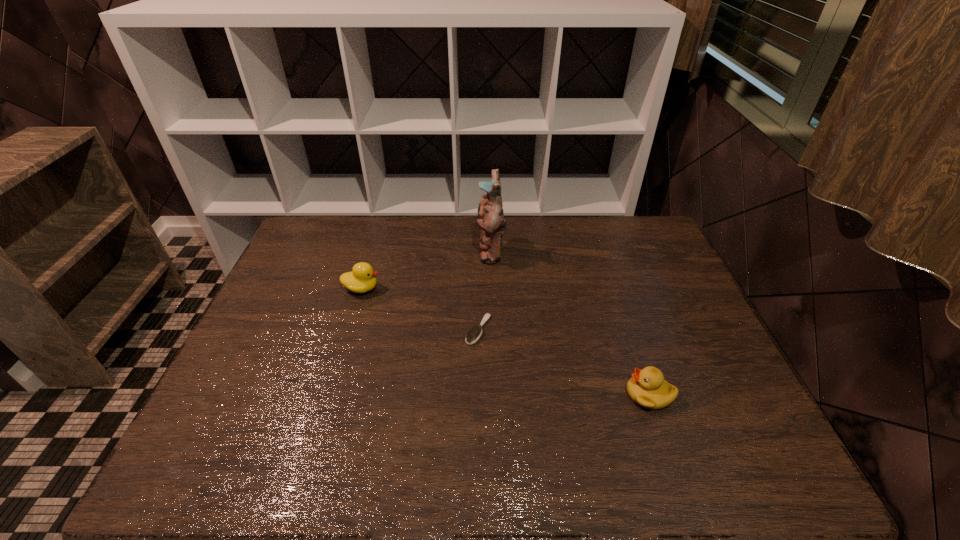
Find the location of a particular element. vacant region at the right edge of the desktop is located at coordinates (664, 290).

In the image, there is a desktop. Identify the location of vacant area at the near right corner. This screenshot has width=960, height=540. (755, 444).

At what (x,y) coordinates should I click in order to perform the action: click on empty space that is in between the farthest object and the third nearest object. Please return your answer as a coordinate pair (x, y). This screenshot has width=960, height=540. Looking at the image, I should click on (426, 271).

At what (x,y) coordinates should I click in order to perform the action: click on unoccupied position between the leftmost object and the rightmost object. Please return your answer as a coordinate pair (x, y). Looking at the image, I should click on (506, 341).

Where is `free spot between the scrubbing brush and the rightmost object`? The width and height of the screenshot is (960, 540). free spot between the scrubbing brush and the rightmost object is located at coordinates (564, 362).

Locate an element on the screen. This screenshot has width=960, height=540. free area in between the leftmost object and the right duckling is located at coordinates (506, 341).

Locate an element on the screen. The width and height of the screenshot is (960, 540). free spot between the figurine and the right duckling is located at coordinates (570, 323).

The height and width of the screenshot is (540, 960). I want to click on free space between the farther duckling and the nearest object, so click(x=506, y=341).

I want to click on vacant region between the third nearest object and the rightmost object, so click(506, 341).

Where is `empty space that is in between the nearer duckling and the leftmost object`? empty space that is in between the nearer duckling and the leftmost object is located at coordinates (506, 341).